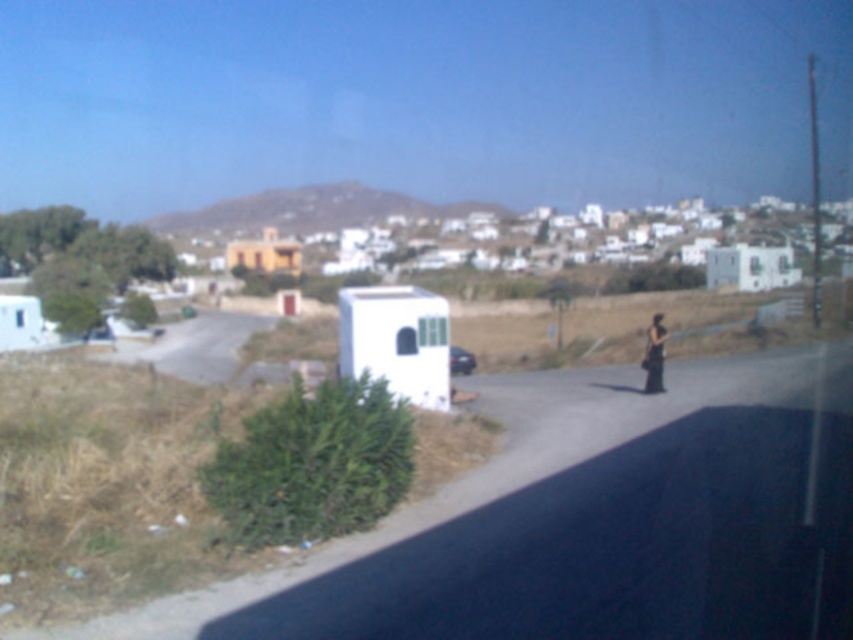
You are a delivery person who needs to place a black fabric bag at center and a white matte trailer at center on the road in the image. Which object should be placed closer to the camera to ensure both fit on the road without overlapping?

The black fabric bag at center is shorter than the white matte trailer at center, so place the black fabric bag at center closer to the camera and the white matte trailer at center further back to ensure they don not overlap on the road.

You are standing at the point marked as point (x=657, y=353). You want to walk to the nearest building in the background. How far will you have to walk?

The distance between you and the nearest building is 17.86 meters.

You are a hiker carrying a black fabric bag at center and a white matte trailer at center on a rural road. Which item will require more space to store due to its size?

The black fabric bag at center has a larger size compared to the white matte trailer at center, so it will require more space to store.